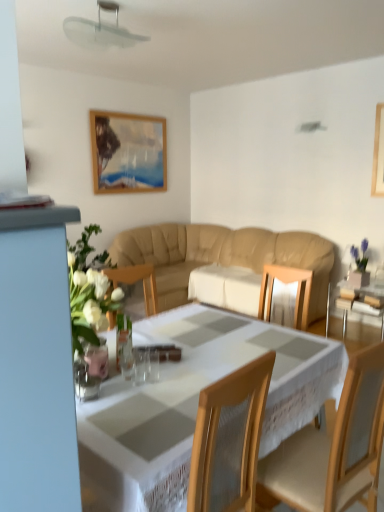
Where is `free point to the right of clear glass vase at lower left`? The height and width of the screenshot is (512, 384). free point to the right of clear glass vase at lower left is located at coordinates (135, 396).